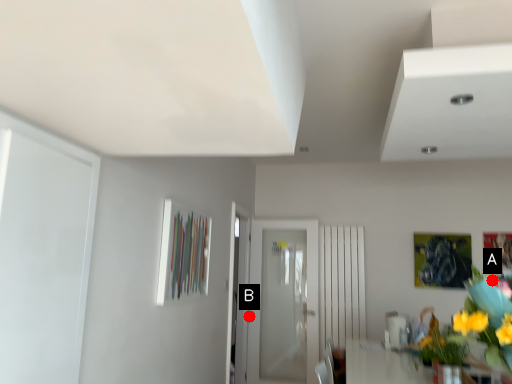
Question: Two points are circled on the image, labeled by A and B beside each circle. Among these points, which one is nearest to the camera?

Choices:
 (A) A is closer
 (B) B is closer

Answer: (A)